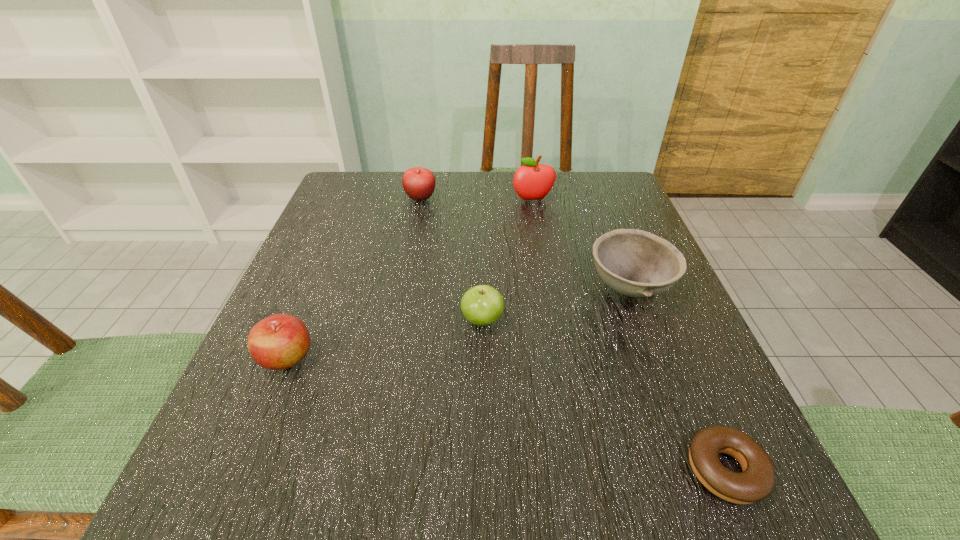
You are a GUI agent. You are given a task and a screenshot of the screen. Output one action in this format:
    pyautogui.click(x=<x>, y=<y>)
    Task: Click on the object that is at the near right corner
    This screenshot has height=540, width=960.
    Given the screenshot: What is the action you would take?
    pyautogui.click(x=756, y=482)

Identify the location of vacant region at the far edge of the desktop. (543, 198).

The width and height of the screenshot is (960, 540). Identify the location of vacant region at the near edge of the desktop. (633, 526).

Identify the location of vacant space at the left edge of the desktop. Image resolution: width=960 pixels, height=540 pixels. [350, 265].

Locate an element on the screen. This screenshot has width=960, height=540. vacant space at the right edge of the desktop is located at coordinates (726, 394).

In the image, there is a desktop. Where is `vacant space at the far left corner`? Image resolution: width=960 pixels, height=540 pixels. vacant space at the far left corner is located at coordinates (370, 205).

Identify the location of vacant space at the near left corner. (241, 502).

Locate an element on the screen. vacant area that lies between the second nearest apple and the fifth object from right to left is located at coordinates tap(451, 259).

Find the location of a particular element. Image resolution: width=960 pixels, height=540 pixels. free space that is in between the rightmost apple and the bowl is located at coordinates (581, 244).

The image size is (960, 540). Find the location of `empty location between the rightmost apple and the third object from left to right`. empty location between the rightmost apple and the third object from left to right is located at coordinates (508, 260).